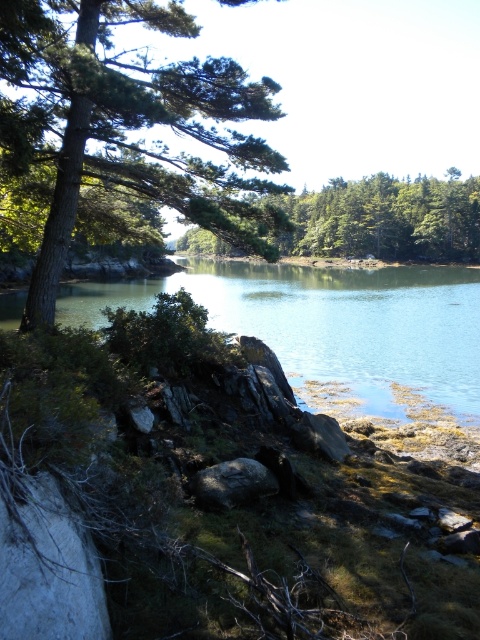
Question: Which object is farther from the camera taking this photo?

Choices:
 (A) green textured tree at upper left
 (B) gray rough rock at center
 (C) clear water at center
 (D) green matte tree at center

Answer: (C)

Question: Is green textured tree at upper left to the right of gray rough rock at center from the viewer's perspective?

Choices:
 (A) yes
 (B) no

Answer: (B)

Question: Which point is farther to the camera?

Choices:
 (A) (213, 502)
 (B) (133, 13)
 (C) (456, 376)

Answer: (C)

Question: Which object is farther from the camera taking this photo?

Choices:
 (A) clear water at center
 (B) gray rough rock at center

Answer: (A)

Question: Is green textured tree at upper left to the left of green matte tree at center from the viewer's perspective?

Choices:
 (A) no
 (B) yes

Answer: (B)

Question: Is clear water at center below green matte tree at center?

Choices:
 (A) yes
 (B) no

Answer: (A)